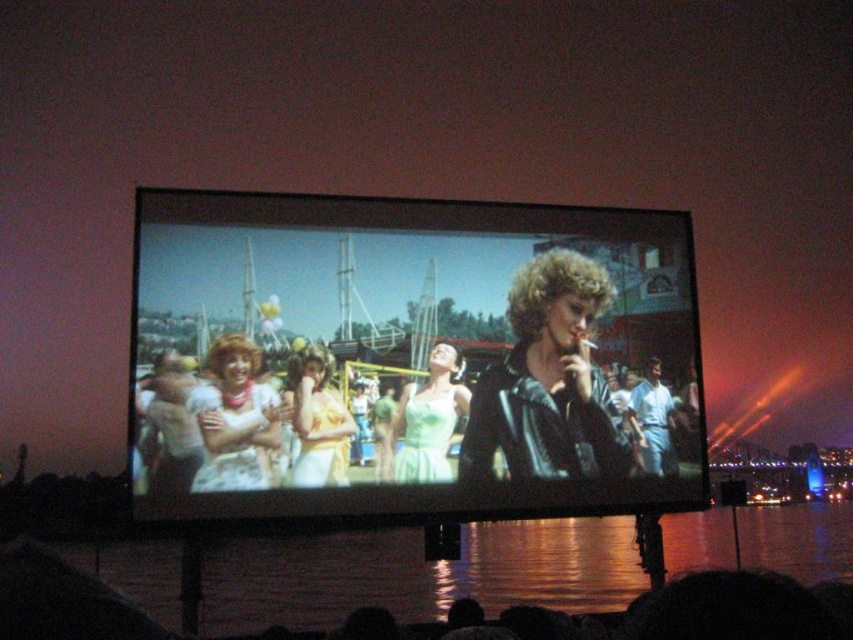
You are an attendee at the carnival and want to take a photo with the person wearing the matte yellow dress at center and the white cotton shirt at center. Since the two people are positioned in a certain way, where should you stand to ensure both are fully visible in your photo?

You should stand behind the white cotton shirt at center because the matte yellow dress at center is in front of the white cotton shirt at center, so positioning yourself behind the latter will allow you to capture both in the frame without one blocking the other.

You are an event planner looking at the screen showing the fair scene. You need to determine which of the two outfits, the matte yellow dress at center or the white cotton shirt at center, is more suitable for a photo shoot focusing on highlighting the vibrant colors of the event. Based on their sizes, which outfit would stand out more in the photos?

The matte yellow dress at center has a larger size compared to the white cotton shirt at center, so it would stand out more in the photos due to its bigger size.

You are an event planner looking at the screen showing the fair scene. You notice two dresses in the crowd. The light green satin dress at center and the matte yellow dress at center. Which dress is closer to the bottom of the screen?

The light green satin dress at center is positioned under the matte yellow dress at center, so it is closer to the bottom of the screen.